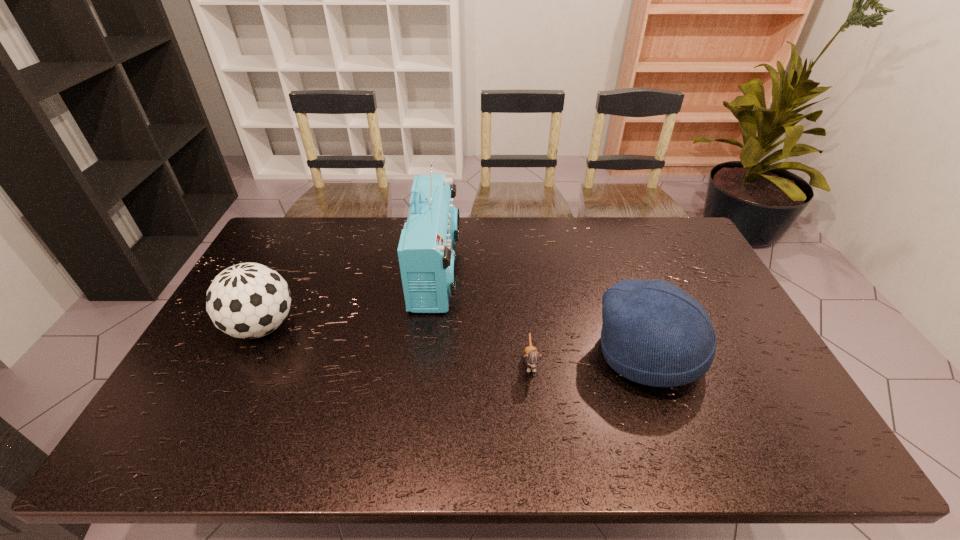
Find the location of a particular element. The height and width of the screenshot is (540, 960). vacant area that lies between the soccer ball and the skullcap is located at coordinates (455, 340).

In order to click on empty location between the soccer ball and the radio receiver in this screenshot , I will do pyautogui.click(x=349, y=299).

Where is `vacant space that is in between the kitten and the radio receiver`? This screenshot has width=960, height=540. vacant space that is in between the kitten and the radio receiver is located at coordinates (484, 317).

Identify the location of vacant region between the shortest object and the leftmost object. This screenshot has height=540, width=960. (396, 345).

Identify the location of vacant area that lies between the radio receiver and the leftmost object. (349, 299).

Where is `empty space that is in between the shortest object and the soccer ball`? This screenshot has height=540, width=960. empty space that is in between the shortest object and the soccer ball is located at coordinates (396, 345).

The image size is (960, 540). What are the coordinates of `free space between the leftmost object and the rightmost object` in the screenshot? It's located at (455, 340).

Find the location of a particular element. Image resolution: width=960 pixels, height=540 pixels. object that is the nearest to the skullcap is located at coordinates (532, 358).

The width and height of the screenshot is (960, 540). In order to click on the third closest object to the rightmost object in this screenshot , I will do `click(249, 300)`.

This screenshot has height=540, width=960. In order to click on free location that satisfies the following two spatial constraints: 1. on the back side of the skullcap; 2. on the front-facing side of the radio receiver in this screenshot , I will do `click(618, 271)`.